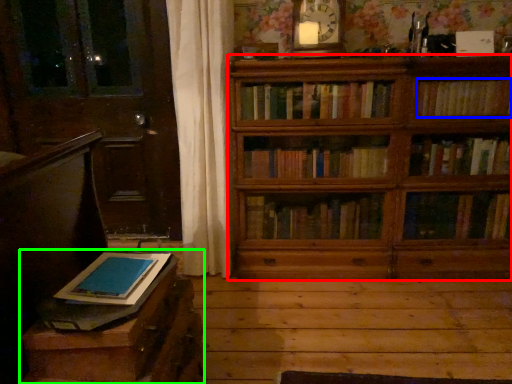
Question: Which object is the closest to the bookcase (highlighted by a red box)? Choose among these: book (highlighted by a blue box) or table (highlighted by a green box).

Choices:
 (A) book
 (B) table

Answer: (A)